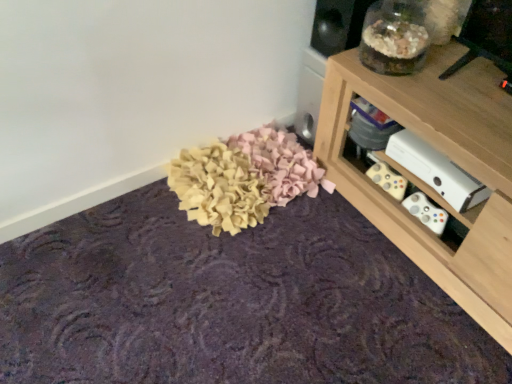
The image size is (512, 384). What do you see at coordinates (429, 186) in the screenshot? I see `wooden shelf at upper right` at bounding box center [429, 186].

Describe the element at coordinates (229, 302) in the screenshot. The height and width of the screenshot is (384, 512). I see `felt-like fabric at center` at that location.

In order to face white matte xbox at lower right, should I rotate leftwards or rightwards?

A 24.543 degree turn to the right will do.

Locate an element on the screen. The image size is (512, 384). white matte xbox at lower right is located at coordinates (436, 171).

The height and width of the screenshot is (384, 512). Identify the location of wooden shelf at upper right. (429, 186).

Where is `mat on the left side of wooden shelf at upper right`? mat on the left side of wooden shelf at upper right is located at coordinates (229, 302).

In the image, is felt-like fabric at center positioned in front of or behind wooden shelf at upper right?

felt-like fabric at center is positioned closer to the viewer than wooden shelf at upper right.

In the image, is felt-like fabric at center on the left side or the right side of wooden shelf at upper right?

Clearly, felt-like fabric at center is on the left of wooden shelf at upper right in the image.

Which object is further away from the camera taking this photo, white matte xbox at lower right or felt-like fabric at center?

Positioned behind is white matte xbox at lower right.

Can you confirm if white matte xbox at lower right is taller than felt-like fabric at center?

Indeed, white matte xbox at lower right has a greater height compared to felt-like fabric at center.

From a real-world perspective, relative to felt-like fabric at center, is white matte xbox at lower right vertically above or below?

white matte xbox at lower right is above felt-like fabric at center.

Is point (416, 86) positioned behind point (15, 300)?

No.

How many degrees apart are the facing directions of wooden shelf at upper right and felt-like fabric at center?

177 degrees separate the facing orientations of wooden shelf at upper right and felt-like fabric at center.

Can you confirm if wooden shelf at upper right is taller than felt-like fabric at center?

Indeed, wooden shelf at upper right has a greater height compared to felt-like fabric at center.

Is wooden shelf at upper right oriented away from felt-like fabric at center?

wooden shelf at upper right is not turned away from felt-like fabric at center.

Are felt-like fabric at center and white matte xbox at lower right far apart?

No.

Looking at this image, which object is closer to the camera, felt-like fabric at center or white matte xbox at lower right?

felt-like fabric at center is more forward.

Is felt-like fabric at center aimed at white matte xbox at lower right?

No, felt-like fabric at center is not facing towards white matte xbox at lower right.

How different are the orientations of wooden shelf at upper right and white matte xbox at lower right in degrees?

0.000531 degrees.

From a real-world perspective, is wooden shelf at upper right under white matte xbox at lower right?

Yes, from a real-world perspective, wooden shelf at upper right is beneath white matte xbox at lower right.

Consider the image. Visually, is wooden shelf at upper right positioned to the left or to the right of white matte xbox at lower right?

From the image, it's evident that wooden shelf at upper right is to the right of white matte xbox at lower right.

Is wooden shelf at upper right further to the viewer compared to white matte xbox at lower right?

No.

Consider the image. Looking at their sizes, would you say white matte xbox at lower right is wider or thinner than wooden shelf at upper right?

In the image, white matte xbox at lower right appears to be more narrow than wooden shelf at upper right.

From the image's perspective, between white matte xbox at lower right and wooden shelf at upper right, who is located below?

From the image's view, wooden shelf at upper right is below.

Is white matte xbox at lower right aimed at wooden shelf at upper right?

Yes, white matte xbox at lower right is turned towards wooden shelf at upper right.

Locate an element on the screen. The width and height of the screenshot is (512, 384). shelf on the right of felt-like fabric at center is located at coordinates (429, 186).

At what (x,y) coordinates should I click in order to perform the action: click on mat below the white matte xbox at lower right (from the image's perspective). Please return your answer as a coordinate pair (x, y). Image resolution: width=512 pixels, height=384 pixels. Looking at the image, I should click on (229, 302).

Considering their positions, is white matte xbox at lower right positioned closer to felt-like fabric at center than wooden shelf at upper right?

Based on the image, wooden shelf at upper right appears to be nearer to felt-like fabric at center.

Estimate the real-world distances between objects in this image. Which object is closer to white matte xbox at lower right, felt-like fabric at center or wooden shelf at upper right?

Among the two, wooden shelf at upper right is located nearer to white matte xbox at lower right.

Based on their spatial positions, is wooden shelf at upper right or felt-like fabric at center further from white matte xbox at lower right?

felt-like fabric at center lies further to white matte xbox at lower right than the other object.

Considering their positions, is white matte xbox at lower right positioned closer to wooden shelf at upper right than felt-like fabric at center?

white matte xbox at lower right is closer to wooden shelf at upper right.

Considering their positions, is wooden shelf at upper right positioned closer to felt-like fabric at center than white matte xbox at lower right?

wooden shelf at upper right is closer to felt-like fabric at center.

Which object lies further to the anchor point wooden shelf at upper right, felt-like fabric at center or white matte xbox at lower right?

felt-like fabric at center is further to wooden shelf at upper right.

Find the location of `appliance situated between felt-like fabric at center and wooden shelf at upper right from left to right`. appliance situated between felt-like fabric at center and wooden shelf at upper right from left to right is located at coordinates (436, 171).